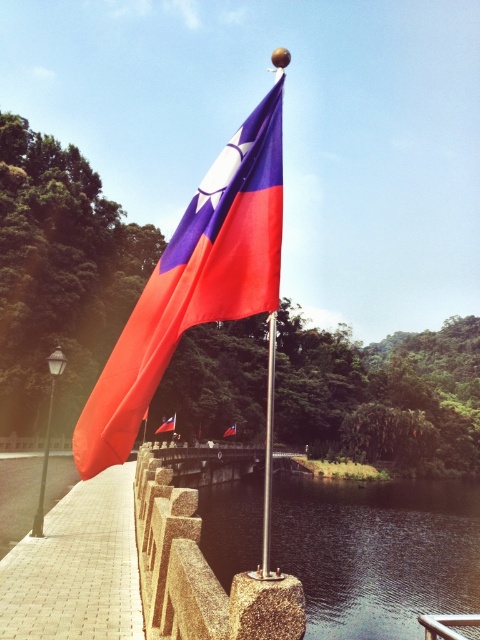
Question: Which point appears farthest from the camera in this image?

Choices:
 (A) (266, 486)
 (B) (444, 616)
 (C) (131, 416)

Answer: (B)

Question: Does silver metallic rail at center have a lesser width compared to red fabric flag at center?

Choices:
 (A) yes
 (B) no

Answer: (B)

Question: Which of the following is the closest to the observer?

Choices:
 (A) transparent glass river at lower center
 (B) matte fabric flag at center
 (C) metallic flag pole at center

Answer: (A)

Question: Can you confirm if matte red flag at center is smaller than red fabric flag at center?

Choices:
 (A) no
 (B) yes

Answer: (A)

Question: Can you confirm if matte red flag at center is wider than red fabric flag at center?

Choices:
 (A) no
 (B) yes

Answer: (B)

Question: Which point appears closest to the camera in this image?

Choices:
 (A) pos(158,432)
 (B) pos(384,577)
 (C) pos(192,288)
 (D) pos(434,637)

Answer: (C)